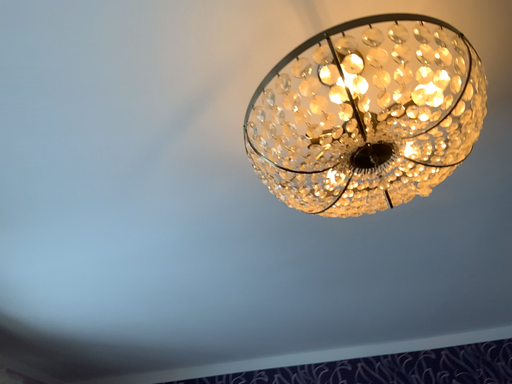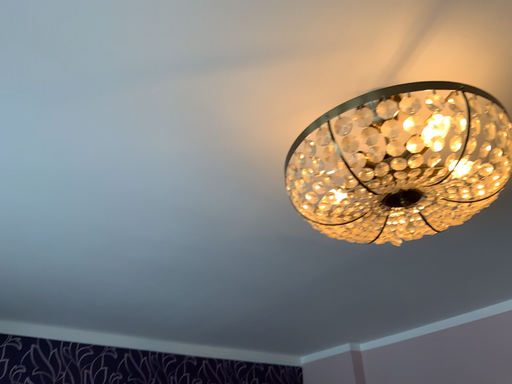
Question: How did the camera likely rotate when shooting the video?

Choices:
 (A) rotated right
 (B) rotated left

Answer: (A)